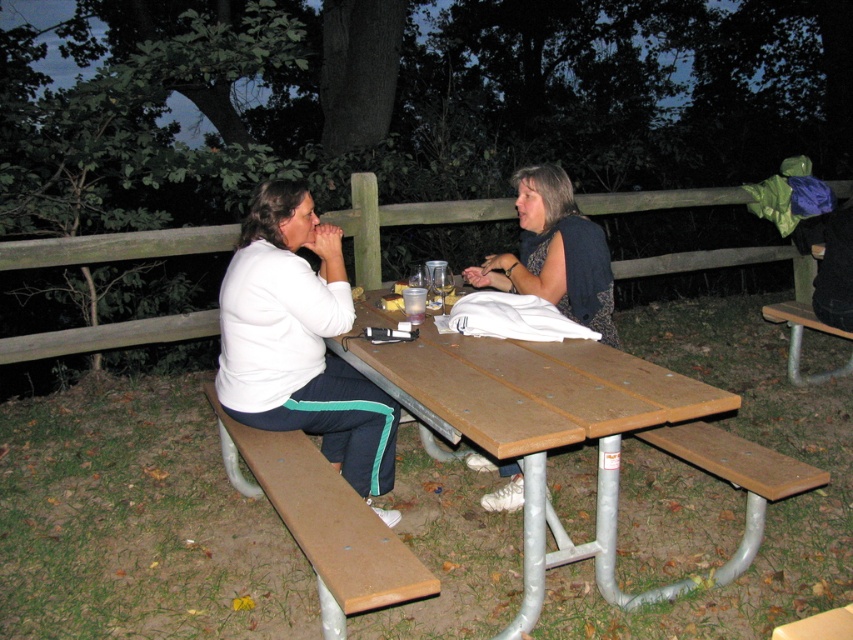
Question: Does brown wood bench at left have a smaller size compared to matte black jacket at center?

Choices:
 (A) yes
 (B) no

Answer: (B)

Question: Which object appears closest to the camera in this image?

Choices:
 (A) white matte pants at left
 (B) brown wood bench at left
 (C) wooden fence at center

Answer: (B)

Question: Which is farther from the wooden fence at center?

Choices:
 (A) wooden bench at lower right
 (B) brown wood bench at right
 (C) brown wood picnic table at center
 (D) white matte shirt at center

Answer: (C)

Question: Among these points, which one is farthest from the camera?

Choices:
 (A) (659, 196)
 (B) (473, 280)
 (C) (267, 416)

Answer: (A)

Question: Can you confirm if white matte shirt at center is positioned above matte black jacket at center?

Choices:
 (A) no
 (B) yes

Answer: (A)

Question: Considering the relative positions of brown wood picnic table at center and white matte shirt at center in the image provided, where is brown wood picnic table at center located with respect to white matte shirt at center?

Choices:
 (A) left
 (B) right

Answer: (B)